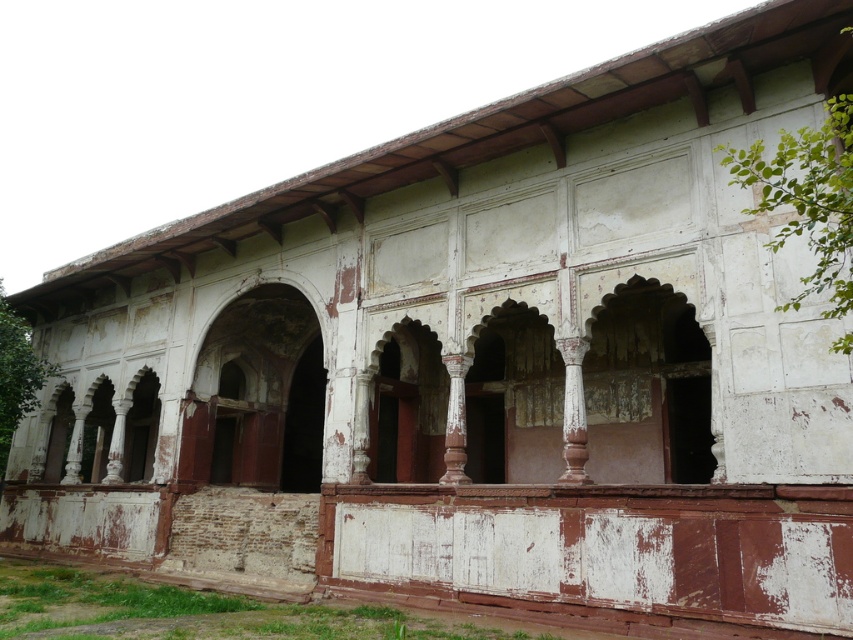
Question: Which of these objects is positioned farthest from the reddish-brown polished pillar at center?

Choices:
 (A) rusty metal archway at center
 (B) rustic stone archway at center

Answer: (A)

Question: Does rusty metal archway at center have a smaller size compared to reddish-brown polished pillar at center?

Choices:
 (A) no
 (B) yes

Answer: (B)

Question: Is rusty metal archway at center below reddish-brown polished pillar at center?

Choices:
 (A) no
 (B) yes

Answer: (B)

Question: Which point is farther to the camera?

Choices:
 (A) (302, 304)
 (B) (389, 408)
 (C) (448, 444)

Answer: (B)

Question: Which point is closer to the camera?

Choices:
 (A) rusty metal archway at center
 (B) rustic stone archway at center
 (C) reddish-brown polished pillar at center

Answer: (C)

Question: Where is rustic stone archway at center located in relation to reddish-brown polished pillar at center in the image?

Choices:
 (A) left
 (B) right

Answer: (A)